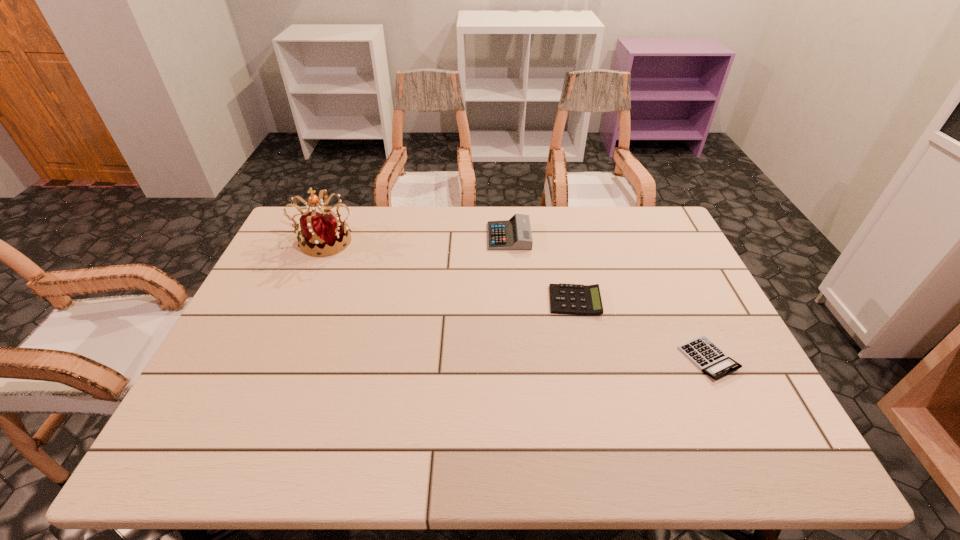
Identify the location of vacant space located 0.330m on the front of the second shortest object. This screenshot has height=540, width=960. (604, 430).

In order to click on free spot located 0.160m on the back of the rightmost calculator in this screenshot , I will do `click(677, 293)`.

At what (x,y) coordinates should I click in order to perform the action: click on tiara present at the far edge. Please return your answer as a coordinate pair (x, y). This screenshot has width=960, height=540. Looking at the image, I should click on (323, 231).

Find the location of `calculator at the far edge`. calculator at the far edge is located at coordinates (514, 234).

The image size is (960, 540). Identify the location of object that is at the left edge. pyautogui.click(x=323, y=231).

Locate an element on the screen. This screenshot has width=960, height=540. object that is positioned at the right edge is located at coordinates (710, 359).

Image resolution: width=960 pixels, height=540 pixels. What are the coordinates of `object located in the far left corner section of the desktop` in the screenshot? It's located at (323, 231).

Locate an element on the screen. vacant space at the far edge is located at coordinates (408, 214).

The height and width of the screenshot is (540, 960). In the image, there is a desktop. Find the location of `free region at the near edge`. free region at the near edge is located at coordinates click(x=621, y=444).

This screenshot has width=960, height=540. In the image, there is a desktop. What are the coordinates of `vacant space at the left edge` in the screenshot? It's located at (290, 292).